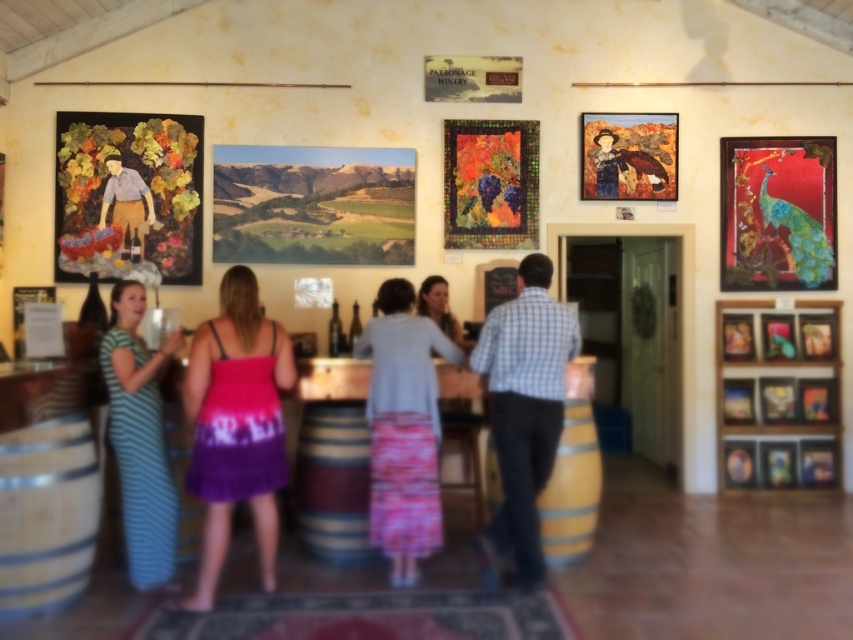
In the scene shown: You are a photographer setting up a shoot in the winery. You notice the blue plaid shirt at center and the metallic gold picture frame at upper right. Which object is closer to you, and why?

The blue plaid shirt at center is closer to you because it is in front of the metallic gold picture frame at upper right.